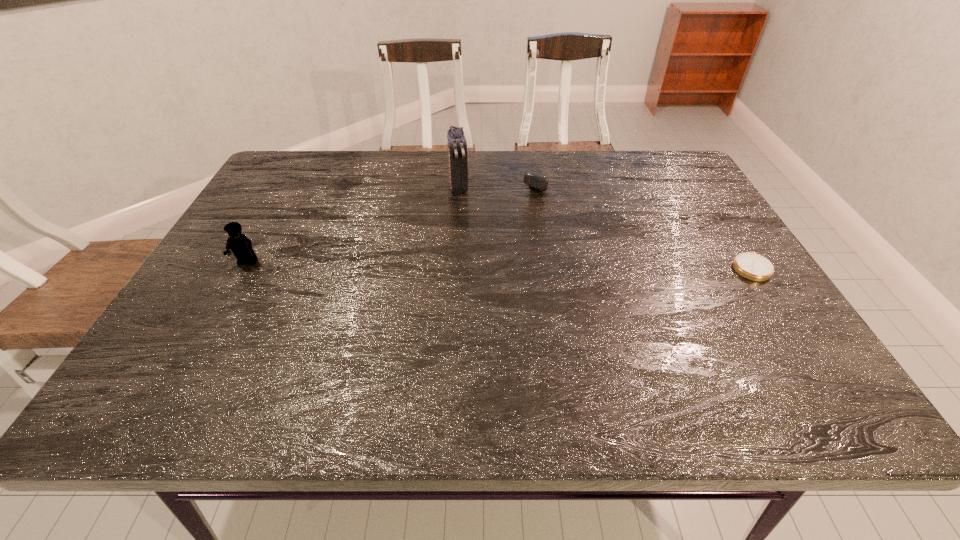
Locate an element on the screen. Image resolution: width=960 pixels, height=540 pixels. free spot between the webcam and the second tallest object is located at coordinates (397, 219).

Locate an element on the screen. The height and width of the screenshot is (540, 960). free spot between the second shortest object and the clutch bag is located at coordinates (503, 181).

What are the coordinates of `vacant space in between the third tallest object and the leftmost object` in the screenshot? It's located at (397, 219).

Where is `free spot between the second tallest object and the tallest object`? free spot between the second tallest object and the tallest object is located at coordinates (353, 224).

I want to click on free space between the second shortest object and the clutch bag, so click(503, 181).

This screenshot has height=540, width=960. Find the location of `empty space that is in between the webcam and the clutch bag`. empty space that is in between the webcam and the clutch bag is located at coordinates (503, 181).

Locate an element on the screen. The image size is (960, 540). object that can be found as the second closest to the leftmost object is located at coordinates (534, 181).

Find the location of a particular element. The width and height of the screenshot is (960, 540). the third closest object to the second object from left to right is located at coordinates (752, 266).

You are a GUI agent. You are given a task and a screenshot of the screen. Output one action in this format:
    pyautogui.click(x=<x>, y=<y>)
    Task: Click on the blank space that satisfies the following two spatial constraints: 1. on the front side of the compass; 2. on the right side of the clutch bag
    The width and height of the screenshot is (960, 540).
    Given the screenshot: What is the action you would take?
    pyautogui.click(x=454, y=267)

I want to click on vacant area that satisfies the following two spatial constraints: 1. on the front-facing side of the Lego; 2. on the left side of the shortest object, so click(245, 267).